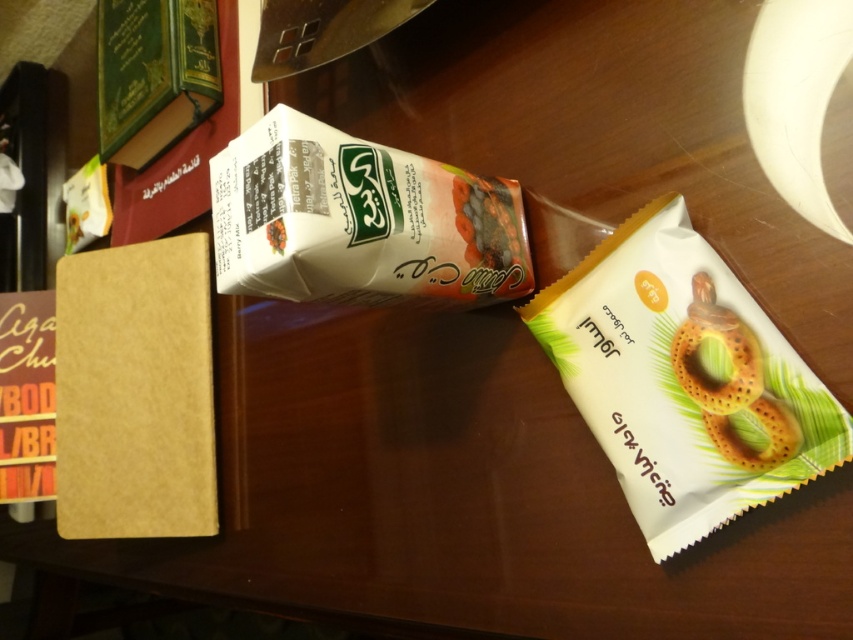
Question: Is matte white bagel at right behind white matte juice carton at center?

Choices:
 (A) yes
 (B) no

Answer: (B)

Question: In this image, where is matte white bagel at right located relative to white matte juice carton at center?

Choices:
 (A) above
 (B) below

Answer: (B)

Question: Does matte white bagel at right appear over white matte juice carton at center?

Choices:
 (A) no
 (B) yes

Answer: (A)

Question: Which point appears farthest from the camera in this image?

Choices:
 (A) (312, 205)
 (B) (523, 317)

Answer: (B)

Question: Among these objects, which one is farthest from the camera?

Choices:
 (A) white matte juice carton at center
 (B) matte white bagel at right

Answer: (A)